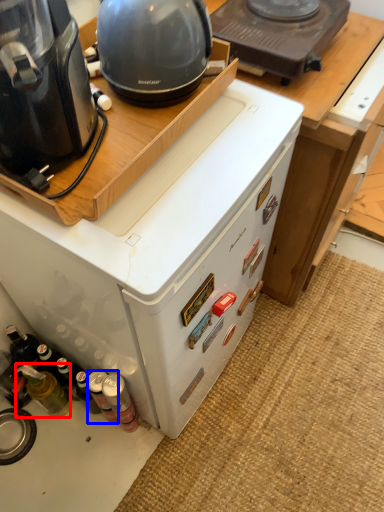
Question: Which point is closer to the camera, bottle (highlighted by a red box) or bottle (highlighted by a blue box)?

Choices:
 (A) bottle
 (B) bottle

Answer: (A)